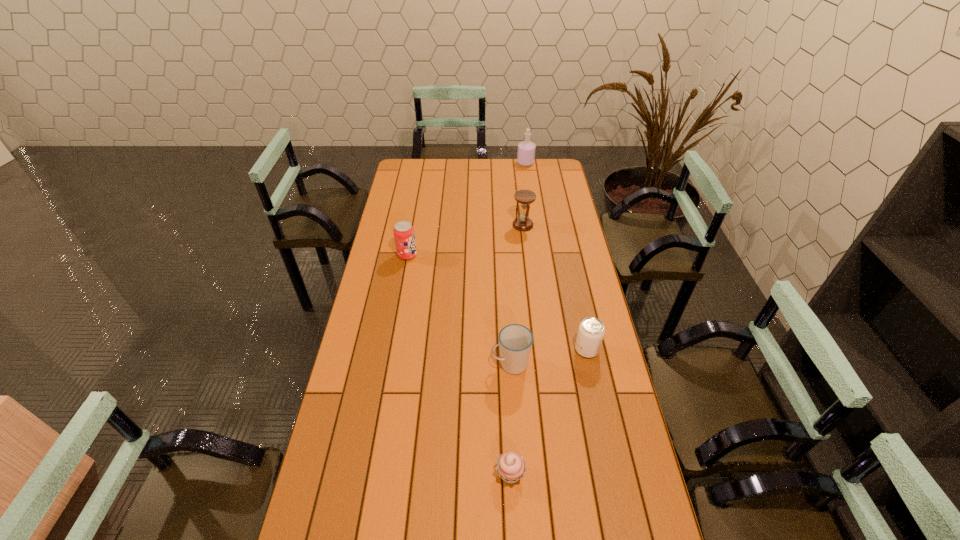
Identify the location of blank space that satisfies the following two spatial constraints: 1. on the back side of the right soda can; 2. on the surface of the farther soda can. (566, 255).

This screenshot has width=960, height=540. Find the location of `vacant area that satisfies the following two spatial constraints: 1. on the surface of the leftmost object; 2. on the left side of the shorter soda can`. vacant area that satisfies the following two spatial constraints: 1. on the surface of the leftmost object; 2. on the left side of the shorter soda can is located at coordinates (391, 349).

What are the coordinates of `vacant region that satisfies the following two spatial constraints: 1. on the back side of the shorter soda can; 2. on the surface of the farther soda can` in the screenshot? It's located at (566, 255).

The image size is (960, 540). In order to click on blank area in the image that satisfies the following two spatial constraints: 1. on the surface of the leftmost object; 2. on the left side of the rightmost object in this screenshot , I will do `click(391, 349)`.

You are a GUI agent. You are given a task and a screenshot of the screen. Output one action in this format:
    pyautogui.click(x=<x>, y=<y>)
    Task: Click on the blank area in the image that satisfies the following two spatial constraints: 1. on the surface of the shorter soda can; 2. on the right side of the fourth nearest object
    The image size is (960, 540).
    Given the screenshot: What is the action you would take?
    pyautogui.click(x=391, y=349)

Where is `vacant space that satisfies the following two spatial constraints: 1. on the front side of the second farthest object; 2. with a handle on the side of the cup`? vacant space that satisfies the following two spatial constraints: 1. on the front side of the second farthest object; 2. with a handle on the side of the cup is located at coordinates (539, 364).